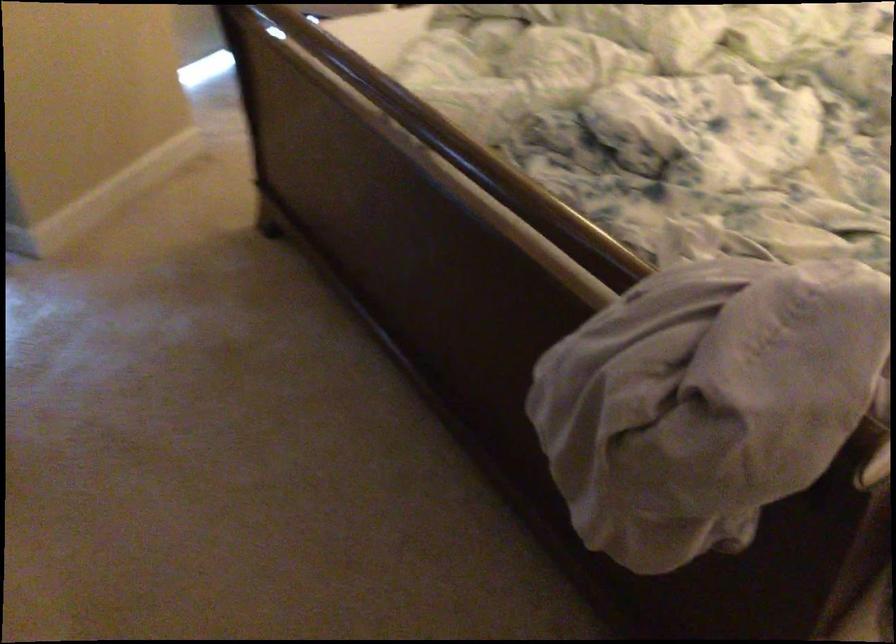
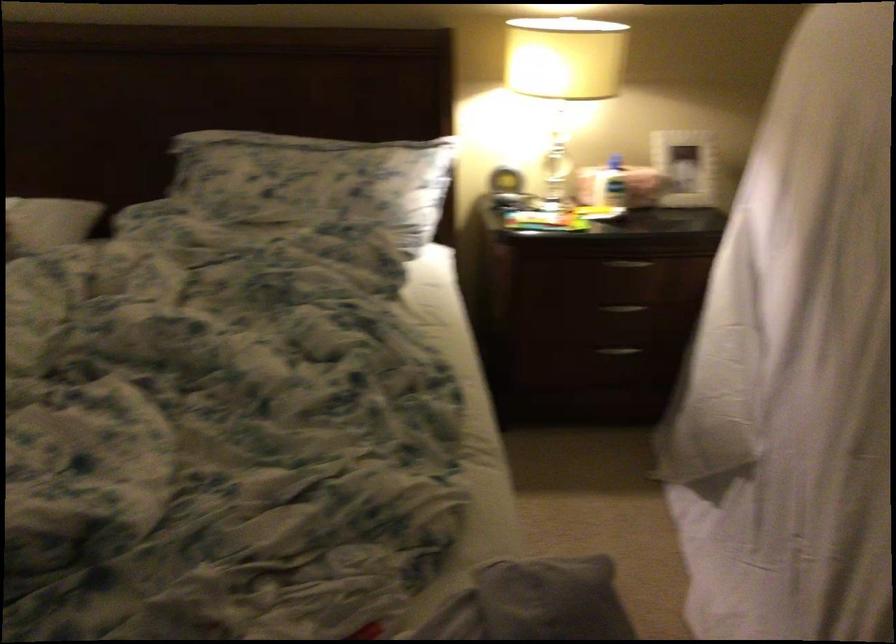
Question: How did the camera likely rotate?

Choices:
 (A) Left
 (B) Right
 (C) Up
 (D) Down

Answer: (B)